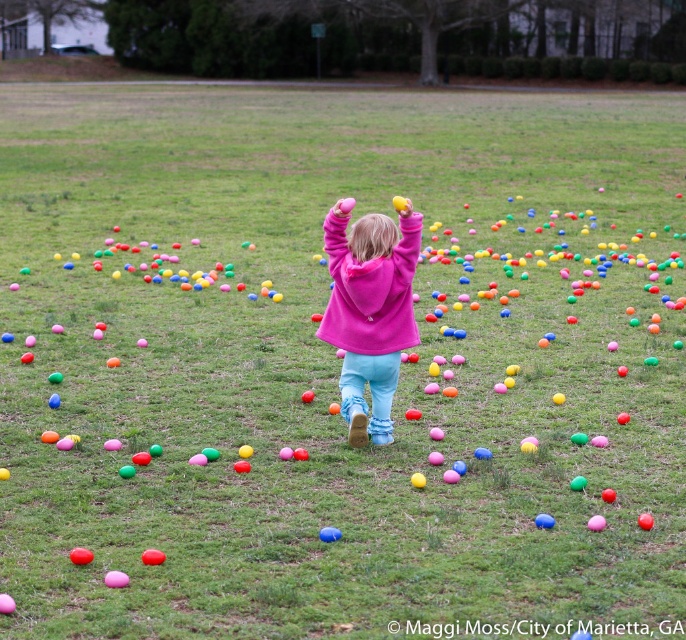
Who is shorter, pink fleece jacket at center or red rubber egg at center?

With less height is red rubber egg at center.

Which is in front, point (331, 243) or point (145, 563)?

Point (145, 563) is more forward.

You are a GUI agent. You are given a task and a screenshot of the screen. Output one action in this format:
    pyautogui.click(x=<x>, y=<y>)
    Task: Click on the pink fleece jacket at center
    The height and width of the screenshot is (640, 686).
    Given the screenshot: What is the action you would take?
    pyautogui.click(x=368, y=310)

Who is more forward, (163, 561) or (331, 538)?

Point (163, 561) is more forward.

Who is more forward, [158,557] or [322,534]?

Point [158,557]

You are a GUI agent. You are given a task and a screenshot of the screen. Output one action in this format:
    pyautogui.click(x=<x>, y=<y>)
    Task: Click on the red rubber egg at center
    
    Given the screenshot: What is the action you would take?
    pyautogui.click(x=152, y=556)

Looking at this image, can you confirm if pink fleece jacket at center is positioned above smooth red ball at center?

Indeed, pink fleece jacket at center is positioned over smooth red ball at center.

Between pink fleece jacket at center and smooth red ball at center, which one has more height?

With more height is pink fleece jacket at center.

Is point (418, 225) positioned after point (80, 561)?

Yes, it is behind point (80, 561).

At what (x,y) coordinates should I click in order to perform the action: click on pink fleece jacket at center. Please return your answer as a coordinate pair (x, y). Image resolution: width=686 pixels, height=640 pixels. Looking at the image, I should click on (368, 310).